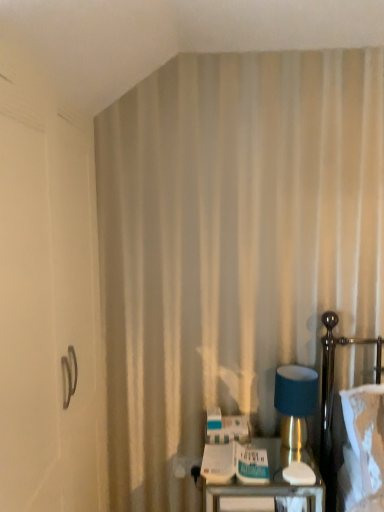
This screenshot has width=384, height=512. Describe the element at coordinates (49, 309) in the screenshot. I see `metallic handle at left` at that location.

What is the approximate height of matte blue fabric at right?

matte blue fabric at right is 13.17 inches in height.

Describe the element at coordinates (268, 486) in the screenshot. I see `metallic silver tray at lower right` at that location.

At what (x,y) coordinates should I click in order to perform the action: click on metallic handle at left. Please return your answer as a coordinate pair (x, y). This screenshot has width=384, height=512. Looking at the image, I should click on (49, 309).

Is metallic silver tray at lower right shorter than metallic handle at left?

Yes, metallic silver tray at lower right is shorter than metallic handle at left.

Is point (264, 501) closer or farther from the camera than point (63, 275)?

Point (264, 501) is farther from the camera than point (63, 275).

Can you confirm if metallic silver tray at lower right is wider than metallic handle at left?

Indeed, metallic silver tray at lower right has a greater width compared to metallic handle at left.

Is metallic handle at left not close to white fabric bed at right?

That's right, there is a large distance between metallic handle at left and white fabric bed at right.

Which is behind, metallic handle at left or white fabric bed at right?

white fabric bed at right is further away from the camera.

Considering the relative sizes of metallic handle at left and white fabric bed at right in the image provided, is metallic handle at left smaller than white fabric bed at right?

Actually, metallic handle at left might be larger than white fabric bed at right.

I want to click on screen door above the white fabric bed at right (from a real-world perspective), so click(x=49, y=309).

Between metallic silver tray at lower right and matte blue fabric at right, which one has larger width?

With larger width is metallic silver tray at lower right.

Considering the sizes of objects metallic silver tray at lower right and matte blue fabric at right in the image provided, who is taller, metallic silver tray at lower right or matte blue fabric at right?

metallic silver tray at lower right is taller.

Based on their positions, is metallic silver tray at lower right located to the left or right of matte blue fabric at right?

Based on their positions, metallic silver tray at lower right is located to the left of matte blue fabric at right.

Locate an element on the screen. The height and width of the screenshot is (512, 384). table lamp above the metallic silver tray at lower right (from a real-world perspective) is located at coordinates [295, 410].

From the image's perspective, which is below, white fabric bed at right or metallic silver tray at lower right?

metallic silver tray at lower right is shown below in the image.

Considering the points (325, 398) and (294, 487), which point is behind, point (325, 398) or point (294, 487)?

Point (325, 398)

Considering the relative positions of white fabric bed at right and metallic silver tray at lower right in the image provided, is white fabric bed at right to the left of metallic silver tray at lower right from the viewer's perspective?

No, white fabric bed at right is not to the left of metallic silver tray at lower right.

This screenshot has width=384, height=512. What are the coordinates of `bed above the metallic silver tray at lower right (from the image's perspective)` in the screenshot? It's located at (332, 396).

From a real-world perspective, is metallic silver tray at lower right positioned over white fabric bed at right based on gravity?

Actually, metallic silver tray at lower right is physically below white fabric bed at right in the real world.

In the scene shown: From the image's perspective, is metallic silver tray at lower right on top of white fabric bed at right?

No, from the image's perspective, metallic silver tray at lower right is not above white fabric bed at right.

Considering the positions of objects metallic silver tray at lower right and white fabric bed at right in the image provided, who is more to the right, metallic silver tray at lower right or white fabric bed at right?

Positioned to the right is white fabric bed at right.

Which is correct: metallic handle at left is inside metallic silver tray at lower right, or outside of it?

metallic handle at left is not inside metallic silver tray at lower right, it's outside.

Which of these two, metallic handle at left or metallic silver tray at lower right, is bigger?

With larger size is metallic handle at left.

Can you confirm if metallic handle at left is positioned to the right of metallic silver tray at lower right?

No, metallic handle at left is not to the right of metallic silver tray at lower right.

From their relative heights in the image, would you say metallic handle at left is taller or shorter than metallic silver tray at lower right?

Clearly, metallic handle at left is taller compared to metallic silver tray at lower right.

The image size is (384, 512). Find the location of `screen door above the white fabric bed at right (from the image's perspective)`. screen door above the white fabric bed at right (from the image's perspective) is located at coordinates (49, 309).

Consider the image. Is white fabric bed at right aimed at metallic handle at left?

No, white fabric bed at right is not oriented towards metallic handle at left.

Is white fabric bed at right not close to metallic handle at left?

Yes.

From a real-world perspective, who is located lower, white fabric bed at right or metallic handle at left?

white fabric bed at right is physically lower.

You are a GUI agent. You are given a task and a screenshot of the screen. Output one action in this format:
    pyautogui.click(x=<x>, y=<y>)
    Task: Click on the furniture to the right of metallic handle at left
    This screenshot has width=384, height=512.
    Given the screenshot: What is the action you would take?
    pyautogui.click(x=268, y=486)

Locate an element on the screen. This screenshot has height=512, width=384. bed that is below the metallic handle at left (from the image's perspective) is located at coordinates (332, 396).

Which object lies further to the anchor point metallic silver tray at lower right, white fabric bed at right or matte blue fabric at right?

white fabric bed at right is further to metallic silver tray at lower right.

Estimate the real-world distances between objects in this image. Which object is further from white fabric bed at right, metallic handle at left or matte blue fabric at right?

Among the two, metallic handle at left is located further to white fabric bed at right.

Based on their spatial positions, is matte blue fabric at right or white fabric bed at right closer to metallic silver tray at lower right?

matte blue fabric at right.

When comparing their distances from matte blue fabric at right, does metallic handle at left or metallic silver tray at lower right seem closer?

metallic silver tray at lower right is closer to matte blue fabric at right.

Looking at the image, which one is located further to metallic silver tray at lower right, metallic handle at left or white fabric bed at right?

metallic handle at left is further to metallic silver tray at lower right.

When comparing their distances from matte blue fabric at right, does metallic handle at left or white fabric bed at right seem closer?

white fabric bed at right.

Which object lies further to the anchor point metallic silver tray at lower right, matte blue fabric at right or metallic handle at left?

Based on the image, metallic handle at left appears to be further to metallic silver tray at lower right.

Which object lies nearer to the anchor point metallic handle at left, white fabric bed at right or matte blue fabric at right?

matte blue fabric at right is positioned closer to the anchor metallic handle at left.

The image size is (384, 512). Identify the location of furniture between metallic handle at left and matte blue fabric at right from left to right. (268, 486).

You are a GUI agent. You are given a task and a screenshot of the screen. Output one action in this format:
    pyautogui.click(x=<x>, y=<y>)
    Task: Click on the table lamp located between metallic silver tray at lower right and white fabric bed at right in the left-right direction
    
    Given the screenshot: What is the action you would take?
    [295, 410]

Where is `table lamp between metallic handle at left and white fabric bed at right from left to right`? Image resolution: width=384 pixels, height=512 pixels. table lamp between metallic handle at left and white fabric bed at right from left to right is located at coordinates (295, 410).

This screenshot has width=384, height=512. What are the coordinates of `furniture between metallic handle at left and white fabric bed at right` in the screenshot? It's located at (268, 486).